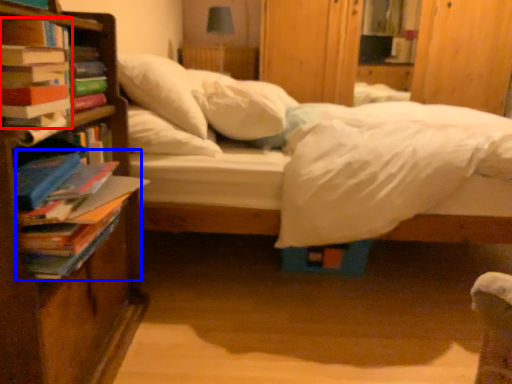
Question: Which object is closer to the camera taking this photo, book (highlighted by a red box) or book (highlighted by a blue box)?

Choices:
 (A) book
 (B) book

Answer: (B)